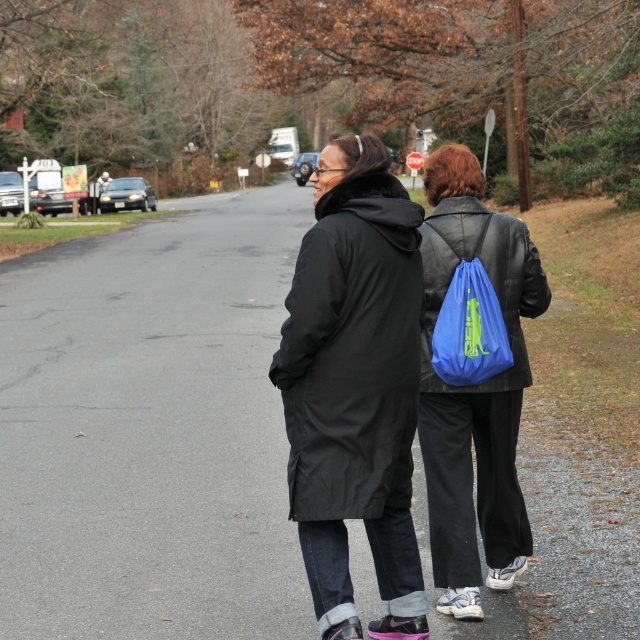
You are a delivery drone that needs to fly between the matte black jacket at center and the blue fabric backpack at right. What is the minimum distance you should maintain between them to avoid collision?

The minimum distance between the matte black jacket at center and the blue fabric backpack at right is 25.60 inches, so the drone should maintain at least that distance to avoid collision.